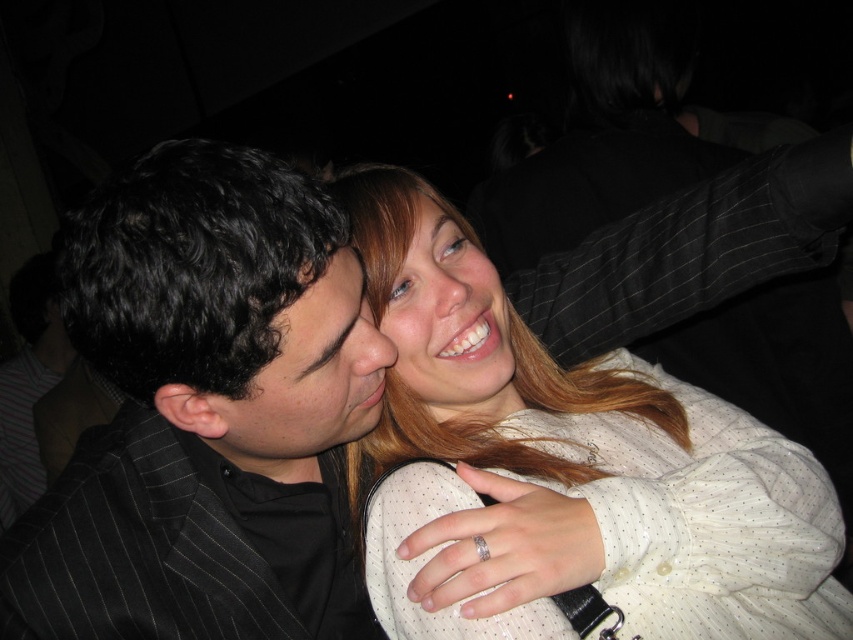
Question: Is black pinstripe suit at left wider than matte black face at center?

Choices:
 (A) no
 (B) yes

Answer: (B)

Question: Is matte black face at center above smooth cream blouse at center?

Choices:
 (A) no
 (B) yes

Answer: (A)

Question: Considering the real-world distances, which object is closest to the matte black face at center?

Choices:
 (A) smooth cream blouse at center
 (B) black pinstripe suit at left

Answer: (B)

Question: Which of these objects is positioned farthest from the white dotted shirt at center?

Choices:
 (A) black pinstripe suit at left
 (B) smooth cream blouse at center

Answer: (A)

Question: Which is farther from the black pinstripe suit at left?

Choices:
 (A) smooth cream blouse at center
 (B) white dotted shirt at center
 (C) matte black face at center

Answer: (B)

Question: Where is black pinstripe suit at left located in relation to white dotted shirt at center in the image?

Choices:
 (A) above
 (B) below

Answer: (A)